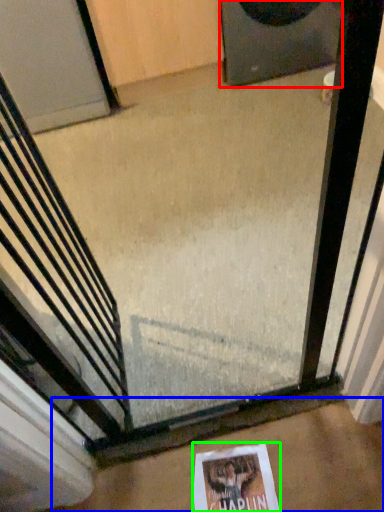
Question: Considering the real-world distances, which object is farthest from speaker (highlighted by a red box)? concrete (highlighted by a blue box) or flyer (highlighted by a green box)?

Choices:
 (A) concrete
 (B) flyer

Answer: (B)